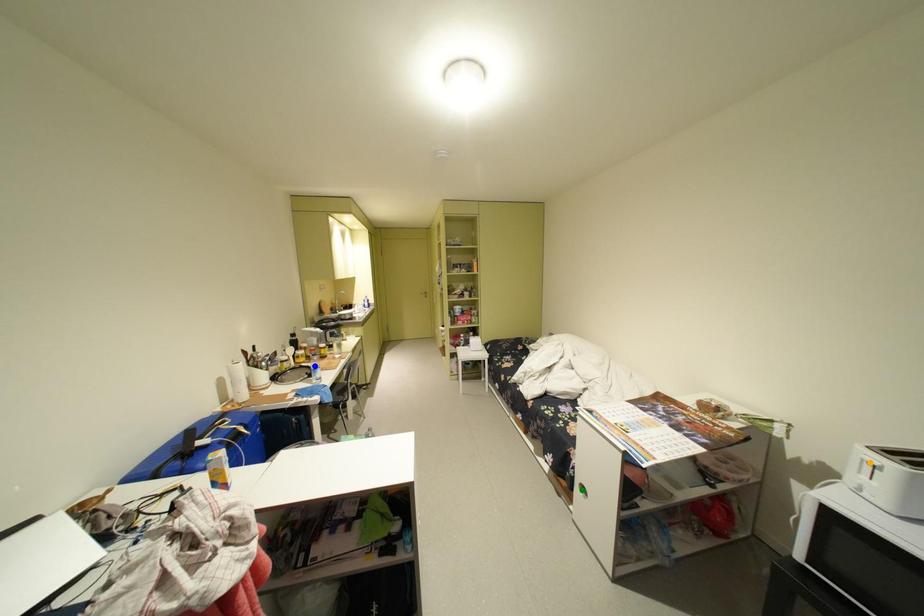
Order these from nearest to farthest:
- blue point
- orange point
- green point

blue point
green point
orange point